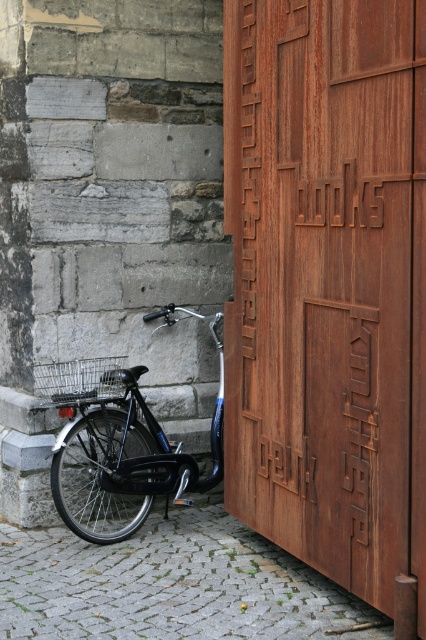
Question: Is rusty metal door at center thinner than shiny black bicycle at lower left?

Choices:
 (A) no
 (B) yes

Answer: (B)

Question: Is rusty metal door at center to the right of shiny black bicycle at lower left from the viewer's perspective?

Choices:
 (A) no
 (B) yes

Answer: (B)

Question: Is rusty metal door at center closer to the viewer compared to shiny black bicycle at lower left?

Choices:
 (A) no
 (B) yes

Answer: (B)

Question: Among these points, which one is nearest to the camera?

Choices:
 (A) (362, 230)
 (B) (135, 493)

Answer: (A)

Question: Which object is closer to the camera taking this photo?

Choices:
 (A) shiny black bicycle at lower left
 (B) rusty metal door at center

Answer: (B)

Question: Which of the following is the farthest from the observer?

Choices:
 (A) (288, 392)
 (B) (103, 492)

Answer: (B)